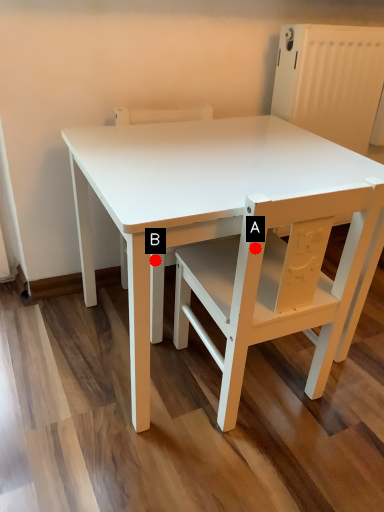
Question: Two points are circled on the image, labeled by A and B beside each circle. Which point is closer to the camera?

Choices:
 (A) A is closer
 (B) B is closer

Answer: (A)